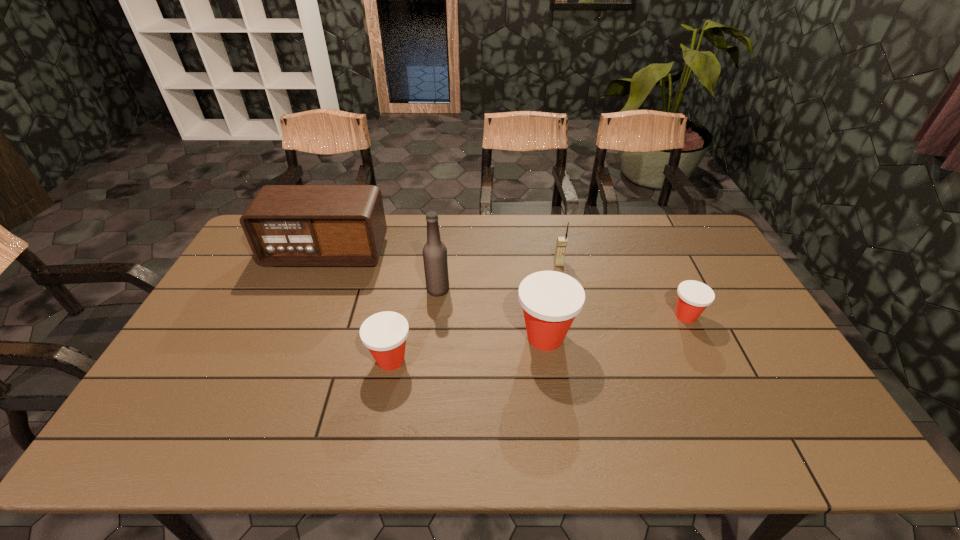
What are the coordinates of `vacant region that satisfies the following two spatial constraints: 1. on the front-facing side of the second shortest Dixie cup; 2. on the left side of the radio receiver` in the screenshot? It's located at (283, 360).